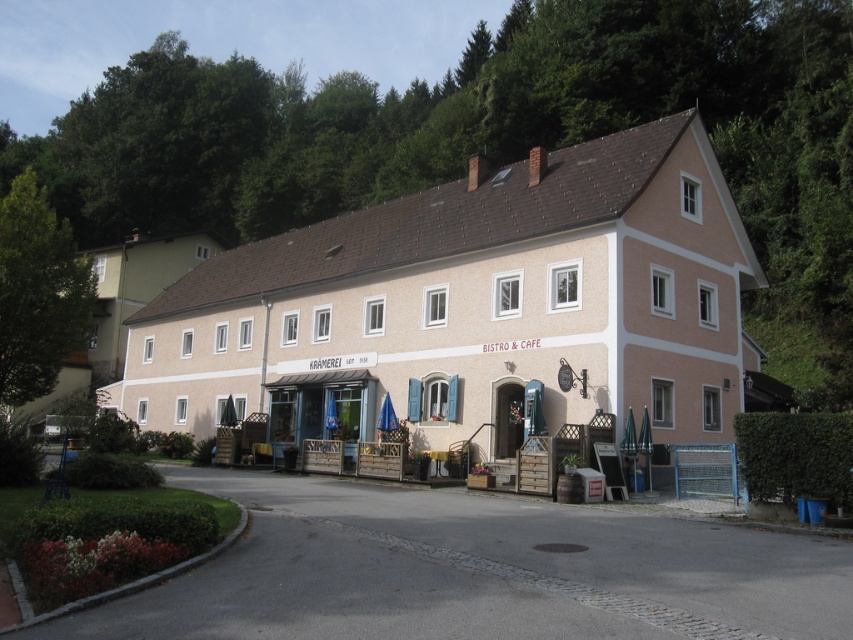
You are a customer standing in the garden bed in front of the light pink stucco building at center and the white painted wood building at lower left. Which building do you see the top of first when looking upward?

The white painted wood building at lower left is taller than the light pink stucco building at center, so you will see the top of the white painted wood building at lower left first when looking upward.

Based on the photo, you are a customer looking for the entrance to the KRAMEREI BISTRO. You see the light pink stucco building at center and the white painted wood building at lower left. Which building is closer to the entrance?

The white painted wood building at lower left is closer to the entrance because the light pink stucco building at center is positioned to its right side, meaning the white painted wood building is closer to the entrance.

You are standing in front of the light pink stucco building at center and the white painted wood building at lower left. Which building is closer to the ground?

The white painted wood building at lower left is closer to the ground because the light pink stucco building at center is positioned under it.